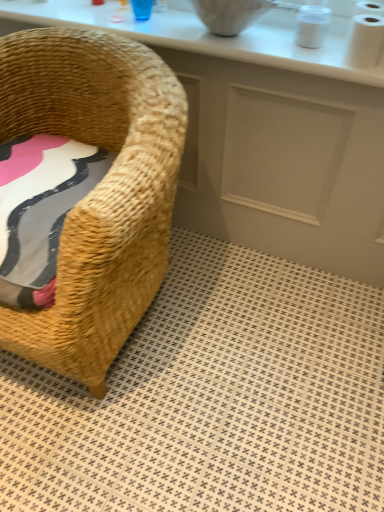
Question: Considering the relative sizes of white glossy counter top at upper center and woven straw chair at left in the image provided, is white glossy counter top at upper center smaller than woven straw chair at left?

Choices:
 (A) no
 (B) yes

Answer: (B)

Question: Is white glossy counter top at upper center bigger than woven straw chair at left?

Choices:
 (A) yes
 (B) no

Answer: (B)

Question: Is white glossy counter top at upper center not inside woven straw chair at left?

Choices:
 (A) no
 (B) yes

Answer: (B)

Question: From the image's perspective, would you say white glossy counter top at upper center is positioned over woven straw chair at left?

Choices:
 (A) yes
 (B) no

Answer: (A)

Question: Is white glossy counter top at upper center taller than woven straw chair at left?

Choices:
 (A) yes
 (B) no

Answer: (B)

Question: Is white glossy counter top at upper center further to camera compared to woven straw chair at left?

Choices:
 (A) no
 (B) yes

Answer: (B)

Question: Does white glossy counter at upper center have a greater height compared to beige woven rug at lower left?

Choices:
 (A) no
 (B) yes

Answer: (B)

Question: Is white glossy counter at upper center far from beige woven rug at lower left?

Choices:
 (A) yes
 (B) no

Answer: (B)

Question: Could you tell me if white glossy counter at upper center is facing beige woven rug at lower left?

Choices:
 (A) no
 (B) yes

Answer: (B)

Question: Considering the relative sizes of white glossy counter at upper center and beige woven rug at lower left in the image provided, is white glossy counter at upper center smaller than beige woven rug at lower left?

Choices:
 (A) yes
 (B) no

Answer: (A)

Question: Is white glossy counter at upper center at the right side of beige woven rug at lower left?

Choices:
 (A) no
 (B) yes

Answer: (A)

Question: Considering the relative sizes of white glossy counter at upper center and beige woven rug at lower left in the image provided, is white glossy counter at upper center wider than beige woven rug at lower left?

Choices:
 (A) yes
 (B) no

Answer: (B)

Question: Is white glossy counter at upper center closer to the viewer compared to white glossy counter top at upper center?

Choices:
 (A) no
 (B) yes

Answer: (A)